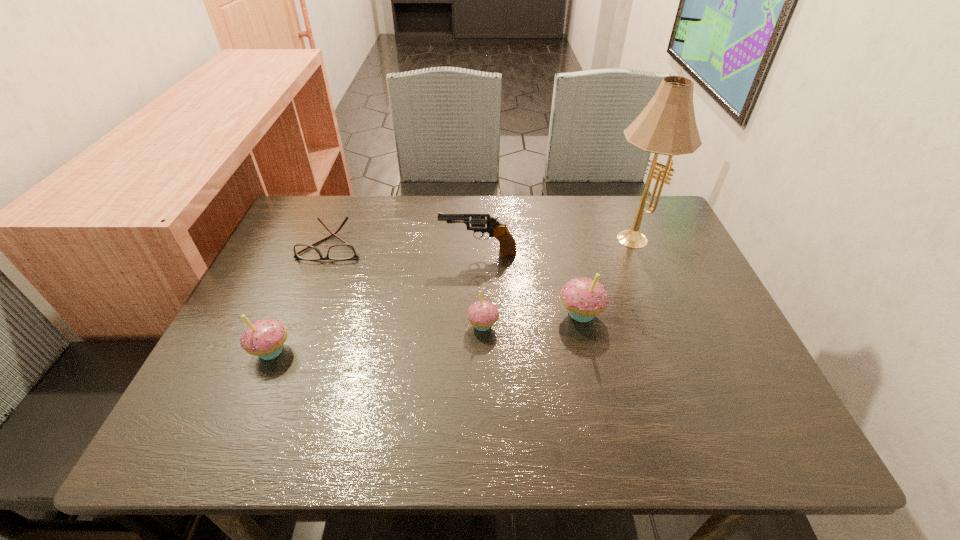
Locate an element on the screen. The height and width of the screenshot is (540, 960). free spot at the far right corner of the desktop is located at coordinates (618, 196).

In the image, there is a desktop. At what (x,y) coordinates should I click in order to perform the action: click on free region at the near right corner. Please return your answer as a coordinate pair (x, y). The width and height of the screenshot is (960, 540). Looking at the image, I should click on pos(724,384).

At what (x,y) coordinates should I click in order to perform the action: click on empty space that is in between the second cupcake from right to left and the leftmost cupcake. Please return your answer as a coordinate pair (x, y). This screenshot has height=540, width=960. Looking at the image, I should click on (377, 338).

At what (x,y) coordinates should I click in order to perform the action: click on vacant space in between the shortest object and the shortest cupcake. Please return your answer as a coordinate pair (x, y). Looking at the image, I should click on (407, 285).

Identify the location of free area in between the tallest cupcake and the leftmost cupcake. 426,332.

Locate an element on the screen. empty location between the second shortest object and the spectacles is located at coordinates (407, 285).

Locate an element on the screen. empty space between the second cupcake from right to left and the tallest object is located at coordinates (559, 280).

Locate an element on the screen. Image resolution: width=960 pixels, height=540 pixels. vacant area that lies between the tallest cupcake and the leftmost cupcake is located at coordinates (426, 332).

The image size is (960, 540). In order to click on free spot between the shortest object and the second tallest cupcake in this screenshot , I will do `click(301, 298)`.

The image size is (960, 540). Identify the location of unoccupied position between the leftmost cupcake and the shortest object. [x=301, y=298].